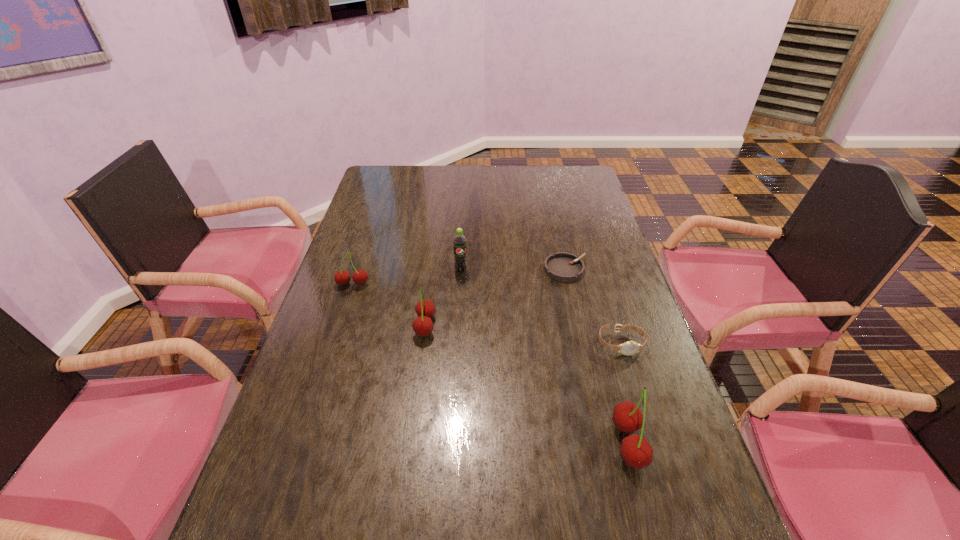
The image size is (960, 540). Find the location of `the farthest cherry`. the farthest cherry is located at coordinates (359, 277).

Image resolution: width=960 pixels, height=540 pixels. I want to click on the third shortest object, so click(359, 277).

Locate an element on the screen. the second shortest cherry is located at coordinates (422, 325).

You are a GUI agent. You are given a task and a screenshot of the screen. Output one action in this format:
    pyautogui.click(x=<x>, y=<y>)
    Task: Click on the second nearest cherry
    The height and width of the screenshot is (540, 960).
    Given the screenshot: What is the action you would take?
    pyautogui.click(x=422, y=325)

Locate an element on the screen. the nearest object is located at coordinates (636, 452).

The height and width of the screenshot is (540, 960). Find the location of `the rightmost cherry`. the rightmost cherry is located at coordinates (636, 452).

You are a GUI agent. You are given a task and a screenshot of the screen. Output one action in this format:
    pyautogui.click(x=<x>, y=<y>)
    Task: Click on the fifth tallest object
    This screenshot has height=540, width=960.
    Given the screenshot: What is the action you would take?
    pyautogui.click(x=628, y=348)

Locate an element on the screen. The width and height of the screenshot is (960, 540). ashtray is located at coordinates (562, 266).

Image resolution: width=960 pixels, height=540 pixels. I want to click on soda, so click(x=459, y=242).

Find the location of a particular element. vacant space located 0.340m on the surface of the leftmost object is located at coordinates (320, 386).